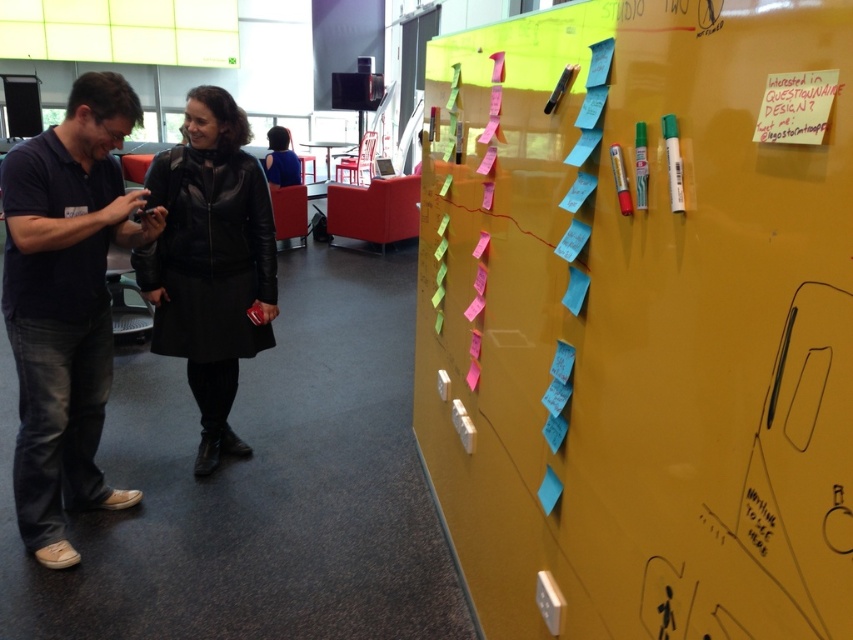
Question: Is yellow matte bulletin board at upper right thinner than dark blue cotton shirt at left?

Choices:
 (A) no
 (B) yes

Answer: (B)

Question: Which object appears farthest from the camera in this image?

Choices:
 (A) black leather jacket at center
 (B) leather jacket at center

Answer: (B)

Question: Which of these objects is positioned farthest from the dark blue cotton shirt at left?

Choices:
 (A) yellow matte bulletin board at upper right
 (B) black leather jacket at center
 (C) leather jacket at center

Answer: (C)

Question: Can you confirm if black leather jacket at center is positioned below leather jacket at center?

Choices:
 (A) no
 (B) yes

Answer: (B)

Question: Which point is closer to the camera taking this photo?

Choices:
 (A) (280, 172)
 (B) (814, 404)
 (C) (39, 456)

Answer: (B)

Question: Observing the image, what is the correct spatial positioning of yellow matte bulletin board at upper right in reference to leather jacket at center?

Choices:
 (A) below
 (B) above

Answer: (A)